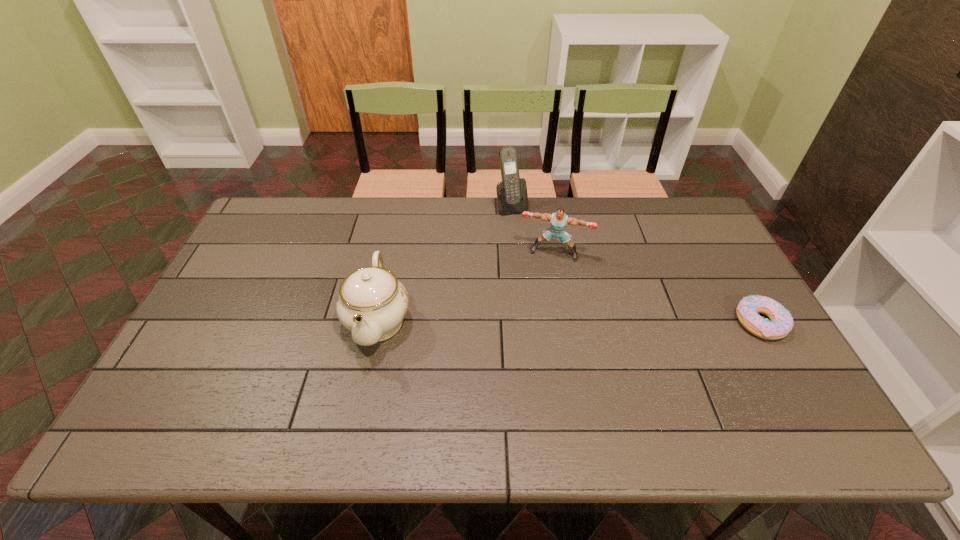
Where is `the leftmost object`? the leftmost object is located at coordinates tap(372, 303).

You are a GUI agent. You are given a task and a screenshot of the screen. Output one action in this format:
    pyautogui.click(x=<x>, y=<y>)
    Task: Click on the doughnut
    
    Given the screenshot: What is the action you would take?
    point(781,323)

Where is `the rightmost object`? The height and width of the screenshot is (540, 960). the rightmost object is located at coordinates (781, 323).

Where is `the third nearest object`? The image size is (960, 540). the third nearest object is located at coordinates (559, 220).

Locate an element on the screen. This screenshot has width=960, height=540. cellular telephone is located at coordinates (512, 197).

Identify the location of vacant position located 0.070m at the spout of the chinaware. This screenshot has width=960, height=540. (364, 389).

You are a GUI agent. You are given a task and a screenshot of the screen. Output one action in this format:
    pyautogui.click(x=<x>, y=<y>)
    Task: Click on the vacant space located on the back of the rightmost object
    The height and width of the screenshot is (540, 960).
    Given the screenshot: What is the action you would take?
    pyautogui.click(x=704, y=225)

Image resolution: width=960 pixels, height=540 pixels. What are the coordinates of `vacant region located on the front-facing side of the puncher` in the screenshot? It's located at (520, 362).

Locate an element on the screen. free spot located on the front-facing side of the puncher is located at coordinates (529, 328).

Identify the location of vacant space located 0.060m on the front-facing side of the puncher. This screenshot has height=540, width=960. (542, 275).